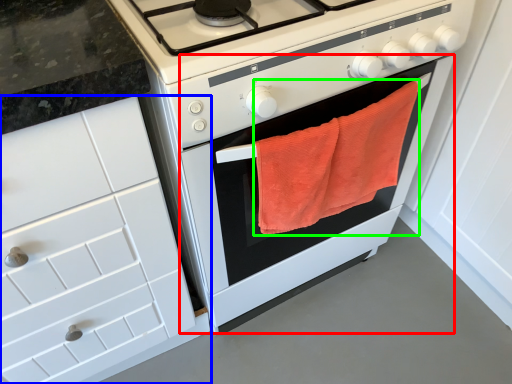
Question: Which object is the closest to the oven (highlighted by a red box)? Choose among these: cabinetry (highlighted by a blue box) or beach towel (highlighted by a green box).

Choices:
 (A) cabinetry
 (B) beach towel

Answer: (B)